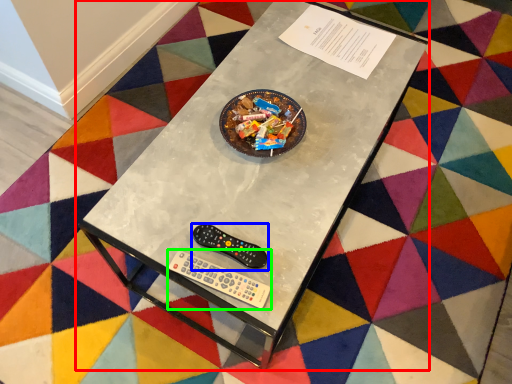
Question: Estimate the real-world distances between objects in this image. Which object is closer to table (highlighted by a red box), control (highlighted by a blue box) or Wii controller (highlighted by a green box)?

Choices:
 (A) control
 (B) Wii controller

Answer: (A)